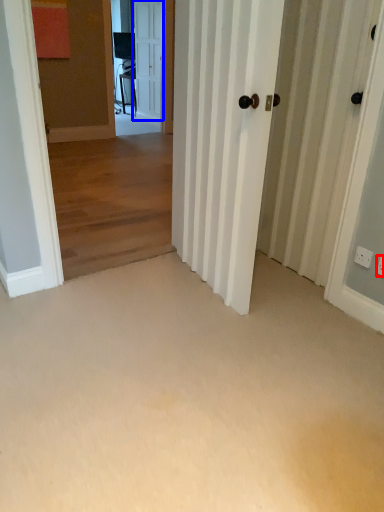
Question: Which object appears closest to the camera in this image, electric outlet (highlighted by a red box) or door (highlighted by a blue box)?

Choices:
 (A) electric outlet
 (B) door

Answer: (A)